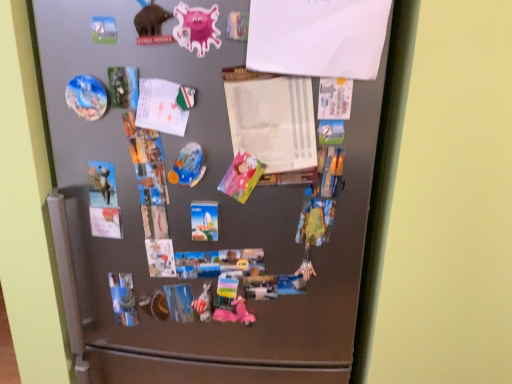
Question: Is white paper at center, the first paper ordered from the bottom, wider than matte plastic magnet at upper left, which is counted as the 4th art, starting from the right?

Choices:
 (A) yes
 (B) no

Answer: (A)

Question: Is white paper at center, the 1th paper from the back, turned away from matte plastic magnet at upper left, positioned as the first art in top-to-bottom order?

Choices:
 (A) no
 (B) yes

Answer: (A)

Question: Is white paper at center, placed as the second paper when sorted from front to back, not near matte plastic magnet at upper left, the 4th art positioned from the bottom?

Choices:
 (A) no
 (B) yes

Answer: (A)

Question: Can you confirm if white paper at center, the 2th paper when ordered from top to bottom, is positioned to the left of matte plastic magnet at upper left, positioned as the first art in top-to-bottom order?

Choices:
 (A) yes
 (B) no

Answer: (B)

Question: Considering the relative sizes of white paper at center, placed as the second paper when sorted from front to back, and matte plastic magnet at upper left, which is counted as the 4th art, starting from the right, in the image provided, is white paper at center, placed as the second paper when sorted from front to back, shorter than matte plastic magnet at upper left, which is counted as the 4th art, starting from the right,?

Choices:
 (A) no
 (B) yes

Answer: (A)

Question: Considering their positions, is shiny metallic plate at center, the 2th art from the top, located in front of or behind white paper at upper center, the first paper positioned from the front?

Choices:
 (A) front
 (B) behind

Answer: (B)

Question: In terms of height, does shiny metallic plate at center, the 3th art viewed from the right, look taller or shorter compared to white paper at upper center, arranged as the second paper when viewed from the back?

Choices:
 (A) tall
 (B) short

Answer: (B)

Question: Is shiny metallic plate at center, the second art from the left, spatially inside white paper at upper center, arranged as the second paper when viewed from the back, or outside of it?

Choices:
 (A) inside
 (B) outside

Answer: (B)

Question: From a real-world perspective, is shiny metallic plate at center, the 3th art viewed from the right, physically located above or below white paper at upper center, positioned as the 1th paper in top-to-bottom order?

Choices:
 (A) below
 (B) above

Answer: (A)

Question: Considering their positions, is white paper at upper center, acting as the 2th paper starting from the bottom, located in front of or behind matte plastic magnet at upper left, the 4th art positioned from the bottom?

Choices:
 (A) behind
 (B) front

Answer: (B)

Question: From a real-world perspective, is white paper at upper center, arranged as the second paper when viewed from the back, above or below matte plastic magnet at upper left, positioned as the first art in top-to-bottom order?

Choices:
 (A) above
 (B) below

Answer: (A)

Question: Considering the relative positions of white paper at upper center, acting as the 2th paper starting from the bottom, and matte plastic magnet at upper left, placed as the first art when sorted from left to right, in the image provided, is white paper at upper center, acting as the 2th paper starting from the bottom, to the left or to the right of matte plastic magnet at upper left, placed as the first art when sorted from left to right,?

Choices:
 (A) left
 (B) right

Answer: (B)

Question: Is white paper at upper center, arranged as the second paper when viewed from the back, spatially inside matte plastic magnet at upper left, which is counted as the 4th art, starting from the right, or outside of it?

Choices:
 (A) inside
 (B) outside

Answer: (B)

Question: Do you think satin silver fridge at center is within white paper at upper center, arranged as the second paper when viewed from the back, or outside of it?

Choices:
 (A) inside
 (B) outside

Answer: (B)

Question: Considering their positions, is satin silver fridge at center located in front of or behind white paper at upper center, the first paper positioned from the front?

Choices:
 (A) behind
 (B) front

Answer: (A)